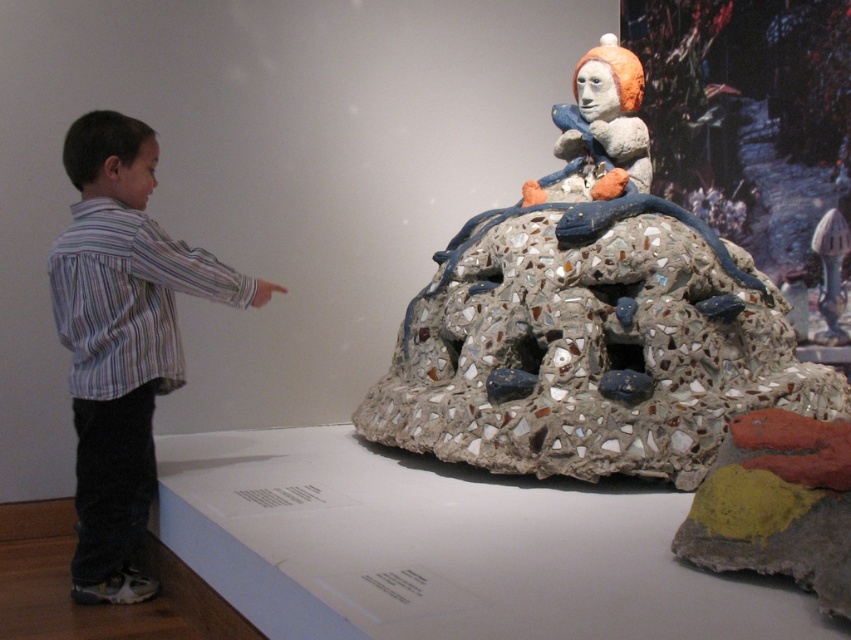
Is mosaic stone sculpture at center further to the viewer compared to striped shirt at left?

Yes, it is behind striped shirt at left.

Looking at this image, how much distance is there between mosaic stone sculpture at center and striped shirt at left?

mosaic stone sculpture at center and striped shirt at left are 3.65 feet apart.

Locate an element on the screen. mosaic stone sculpture at center is located at coordinates (592, 321).